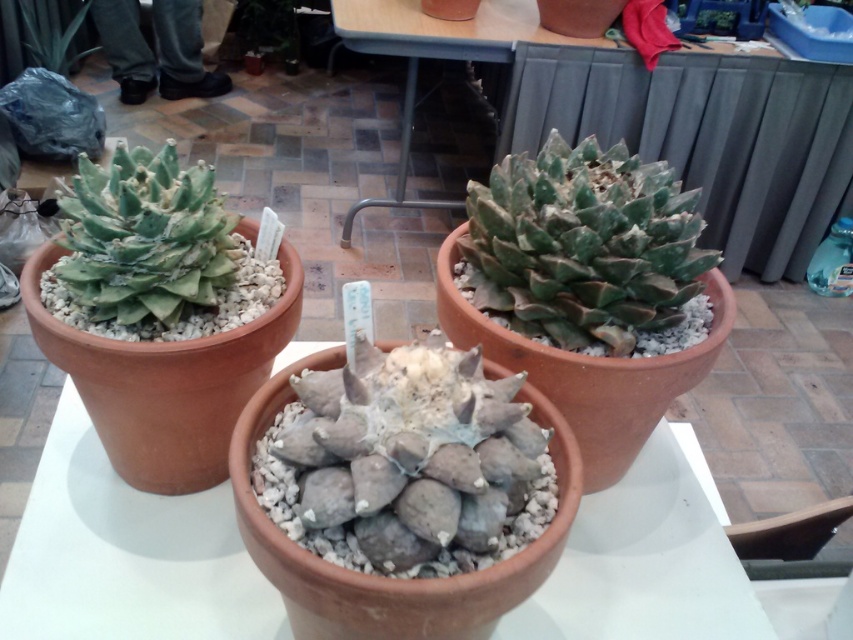
You are a plant enthusiast who wants to place a small decorative statue between the matte clay pot at center and the green matte succulent at center. The statue is 30 centimeters wide. Is there enough space between them to fit the statue without moving either object?

The distance between the matte clay pot at center and the green matte succulent at center is 69.92 centimeters. Since the statue is only 30 centimeters wide, there is sufficient space to place it between them without moving either object.

You are standing at the front of the arrangement and want to reach both point A at point (202,524) and point B at point (183,188). Which point will you need to move forward towards first?

Point B at point (183,188) needs to be reached first because it is closer to you than point A at point (202,524), which is further away.